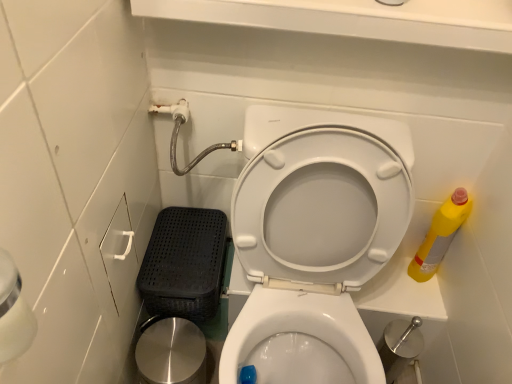
Question: From the image's perspective, is polished stainless steel potty at lower left above or below yellow plastic bottle at right?

Choices:
 (A) above
 (B) below

Answer: (B)

Question: Is polished stainless steel potty at lower left bigger or smaller than yellow plastic bottle at right?

Choices:
 (A) big
 (B) small

Answer: (A)

Question: Which object is the closest to the polished stainless steel potty at lower left?

Choices:
 (A) yellow plastic bottle at right
 (B) white glossy toilet seat at center

Answer: (B)

Question: Which object is positioned farthest from the white glossy toilet seat at center?

Choices:
 (A) yellow plastic bottle at right
 (B) polished stainless steel potty at lower left

Answer: (A)